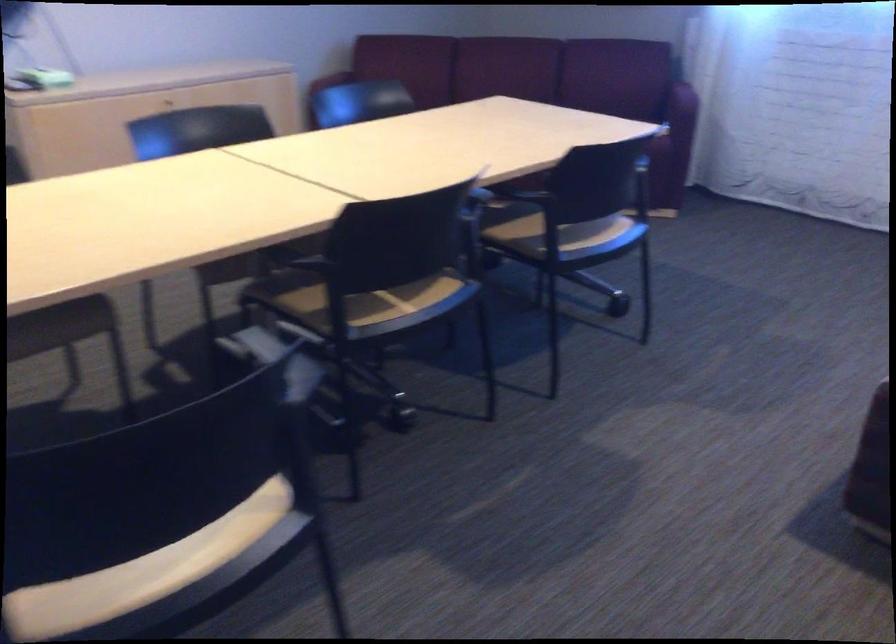
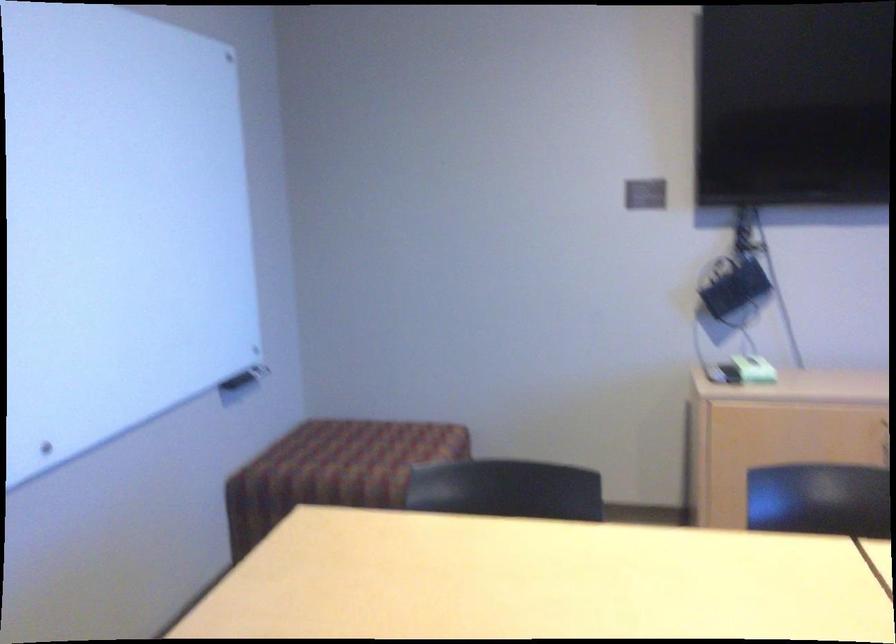
Question: The camera is either moving clockwise (left) or counter-clockwise (right) around the object. The first image is from the beginning of the video and the second image is from the end. Is the camera moving left or right when shooting the video?

Choices:
 (A) Left
 (B) Right

Answer: (B)